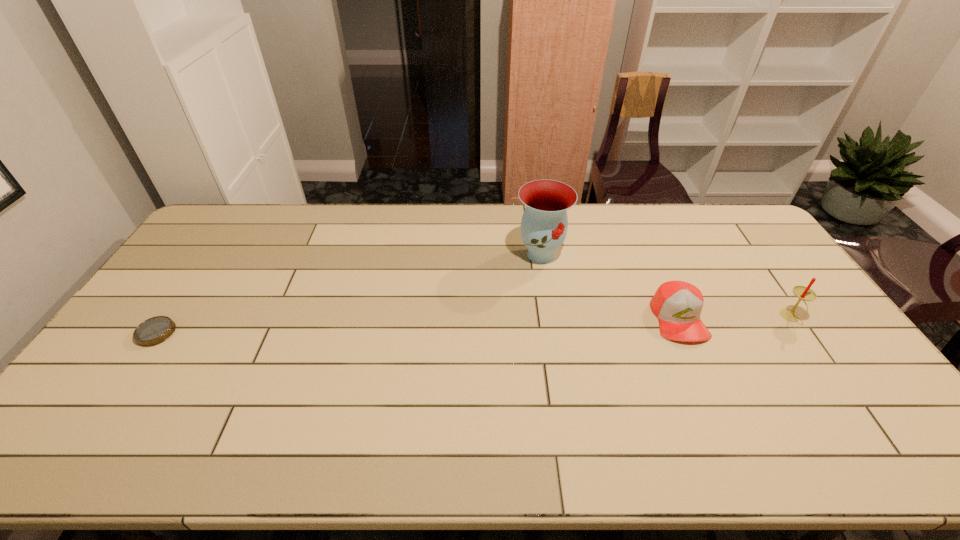
Where is `the closest object relative to the rightmost object`? The width and height of the screenshot is (960, 540). the closest object relative to the rightmost object is located at coordinates (677, 304).

You are a GUI agent. You are given a task and a screenshot of the screen. Output one action in this format:
    pyautogui.click(x=<x>, y=<y>)
    Task: Click on the vacant area that satisfies the following two spatial constraints: 1. on the back side of the second tallest object; 2. on the right side of the shortest object
    This screenshot has width=960, height=540.
    Given the screenshot: What is the action you would take?
    pyautogui.click(x=167, y=317)

Locate an element on the screen. vacant space that satisfies the following two spatial constraints: 1. on the front side of the second tallest object; 2. on the right side of the tallest object is located at coordinates (550, 317).

Image resolution: width=960 pixels, height=540 pixels. Identify the location of free space that satisfies the following two spatial constraints: 1. on the back side of the vase; 2. on the right side of the leftmost object. (210, 254).

What are the coordinates of `vacant area that satisfies the following two spatial constraints: 1. on the front side of the farthest object; 2. on the left side of the rightmost object` in the screenshot? It's located at (550, 317).